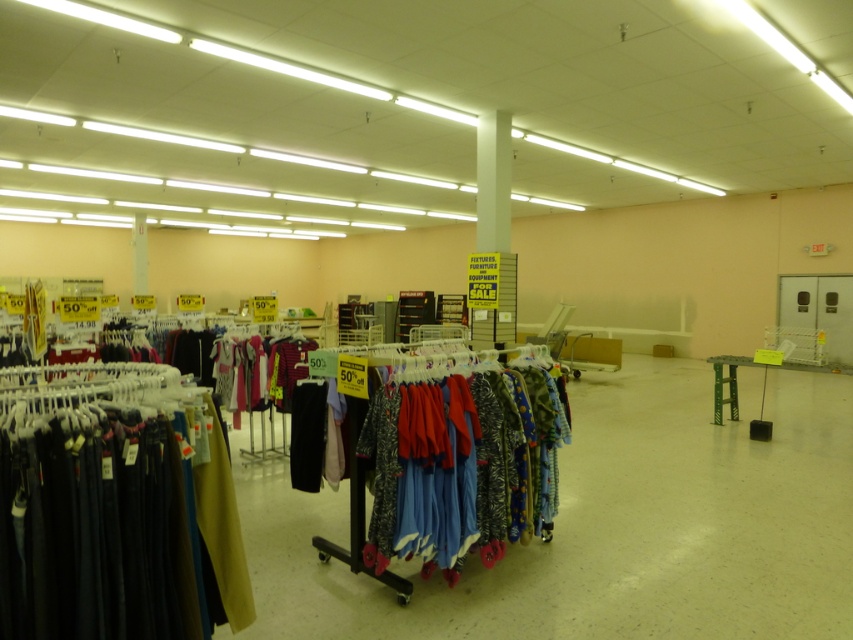
Question: Is dark blue fabric pants at left thinner than matte cotton pajamas at center?

Choices:
 (A) yes
 (B) no

Answer: (A)

Question: Which object is closer to the camera taking this photo?

Choices:
 (A) matte cotton pajamas at center
 (B) dark blue fabric pants at left

Answer: (B)

Question: Is the position of dark blue fabric pants at left more distant than that of matte cotton pajamas at center?

Choices:
 (A) yes
 (B) no

Answer: (B)

Question: Does dark blue fabric pants at left have a larger size compared to matte cotton pajamas at center?

Choices:
 (A) yes
 (B) no

Answer: (B)